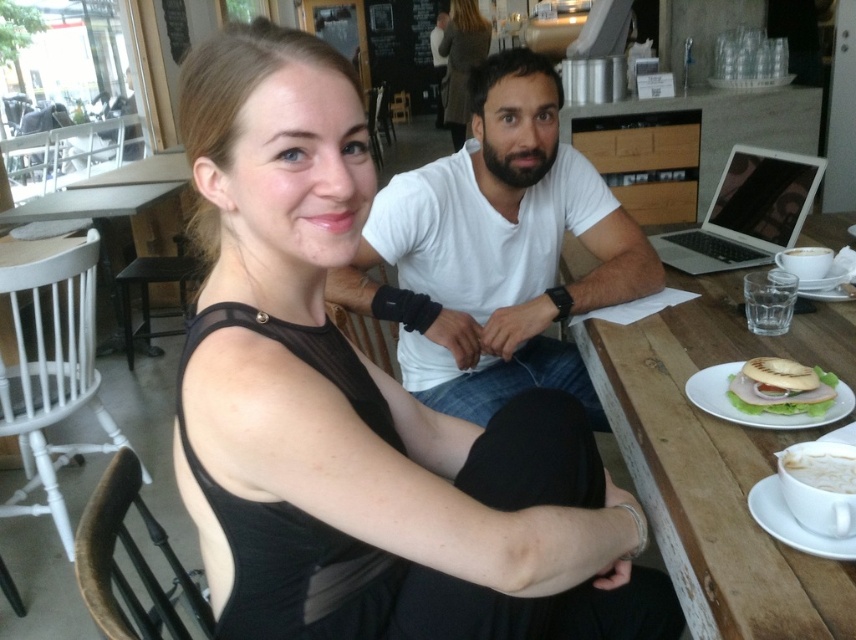
You are a photographer trying to capture a portrait of both the white cotton shirt at center and the wooden table at center. Which object should you focus on first if you want to ensure both are in sharp focus?

The white cotton shirt at center is taller than the wooden table at center, so focusing on the white cotton shirt at center first would ensure both are in sharp focus.

You are a photographer setting up for a portrait. You need to ensure that the white cotton shirt at center and the white frothy coffee at lower right are both in focus. Since the camera can only focus on one subject at a time, which item should you focus on to ensure the other remains in the depth of field?

You should focus on the white cotton shirt at center because it is closer to the camera than the white frothy coffee at lower right, ensuring the coffee stays within the depth of field.